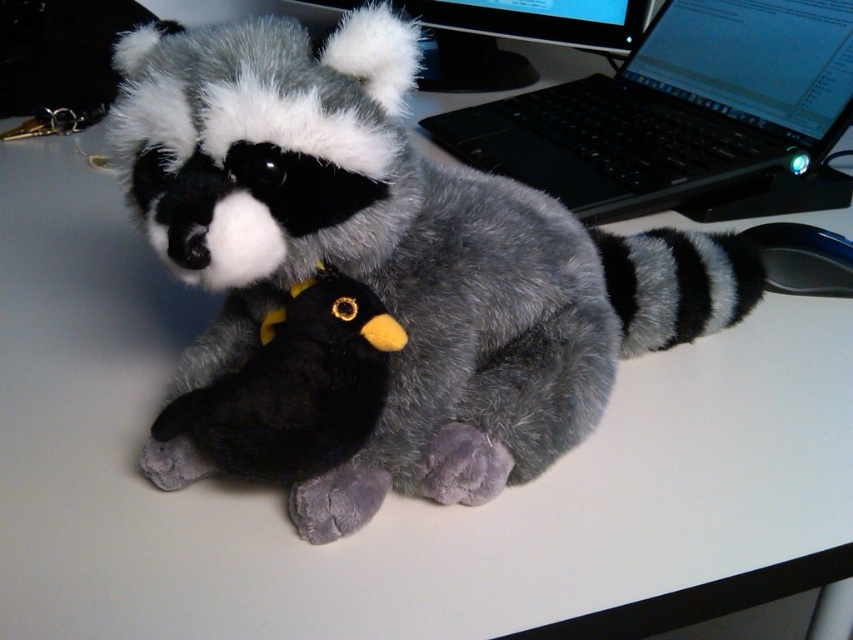
I want to click on black plush bird at center, so click(x=289, y=388).

This screenshot has height=640, width=853. What do you see at coordinates (289, 388) in the screenshot?
I see `black plush bird at center` at bounding box center [289, 388].

Image resolution: width=853 pixels, height=640 pixels. Identify the location of black plush bird at center. point(289,388).

Does fluffy gray raccoon at center appear over black plush bird at center?

Yes.

Is fluffy gray raccoon at center positioned at the back of black plush bird at center?

No, it is in front of black plush bird at center.

The width and height of the screenshot is (853, 640). I want to click on fluffy gray raccoon at center, so (395, 253).

Find the location of a particular element. This screenshot has height=640, width=853. fluffy gray raccoon at center is located at coordinates (395, 253).

In the scene shown: Between black plastic laptop at upper right and black plush bird at center, which one appears on the left side from the viewer's perspective?

black plush bird at center is more to the left.

Does black plastic laptop at upper right have a lesser height compared to black plush bird at center?

In fact, black plastic laptop at upper right may be taller than black plush bird at center.

I want to click on black plastic laptop at upper right, so click(x=683, y=116).

You are a GUI agent. You are given a task and a screenshot of the screen. Output one action in this format:
    pyautogui.click(x=<x>, y=<y>)
    Task: Click on the black plastic laptop at upper right
    This screenshot has height=640, width=853.
    Given the screenshot: What is the action you would take?
    pyautogui.click(x=683, y=116)